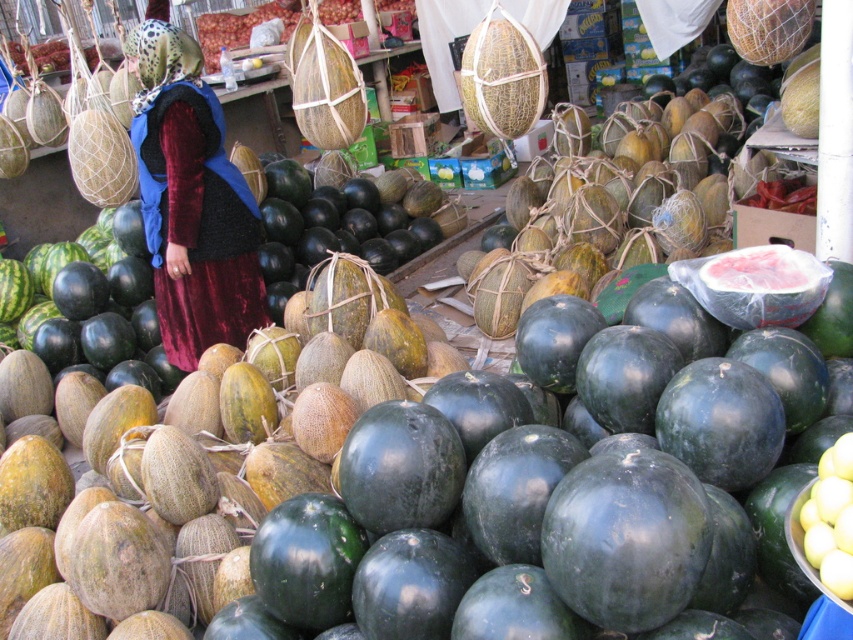
You are a customer at the market and want to find the closest point to your current position. You see two points marked in the image. Which point is closer to you? The points are labeled as point at (277,573) and point at (229,342).

Point at (277,573) is in front of point at (229,342), so it is closer to you.

You are a customer at the market and want to pick up the green matte watermelon at center and the velvet dress at center. However, you can only reach items within 2 meters. Can you reach both items without moving closer?

The distance between the green matte watermelon at center and the velvet dress at center is 2.27 meters, which is beyond your 2 meter reach. Therefore, you cannot reach both items without moving closer.